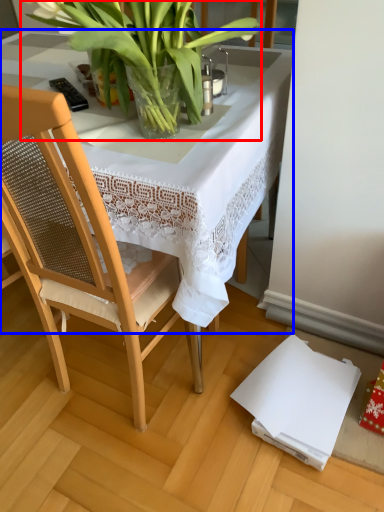
Question: Among these objects, which one is farthest to the camera, houseplant (highlighted by a red box) or table (highlighted by a blue box)?

Choices:
 (A) houseplant
 (B) table

Answer: (B)